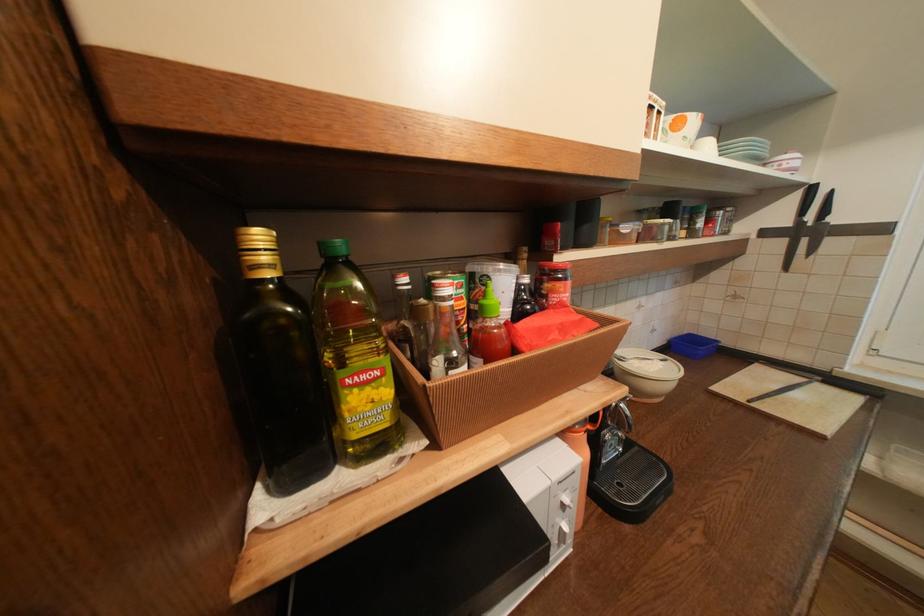
Image resolution: width=924 pixels, height=616 pixels. In order to click on blue plastic container in this screenshot , I will do `click(693, 345)`.